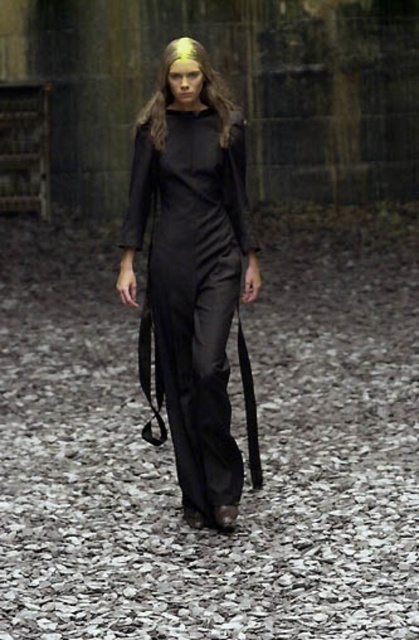
Question: Which of the following is the farthest from the observer?

Choices:
 (A) golden hair at center
 (B) black fabric path at center

Answer: (A)

Question: Considering the real-world distances, which object is closest to the satin black dress at center?

Choices:
 (A) golden hair at center
 (B) black fabric path at center

Answer: (A)

Question: Is satin black dress at center bigger than golden hair at center?

Choices:
 (A) no
 (B) yes

Answer: (A)

Question: Which point is farther to the camera?

Choices:
 (A) satin black dress at center
 (B) golden hair at center
 (C) black fabric path at center

Answer: (B)

Question: Where is black fabric path at center located in relation to golden hair at center in the image?

Choices:
 (A) above
 (B) below

Answer: (B)

Question: Observing the image, what is the correct spatial positioning of black fabric path at center in reference to satin black dress at center?

Choices:
 (A) right
 (B) left

Answer: (A)